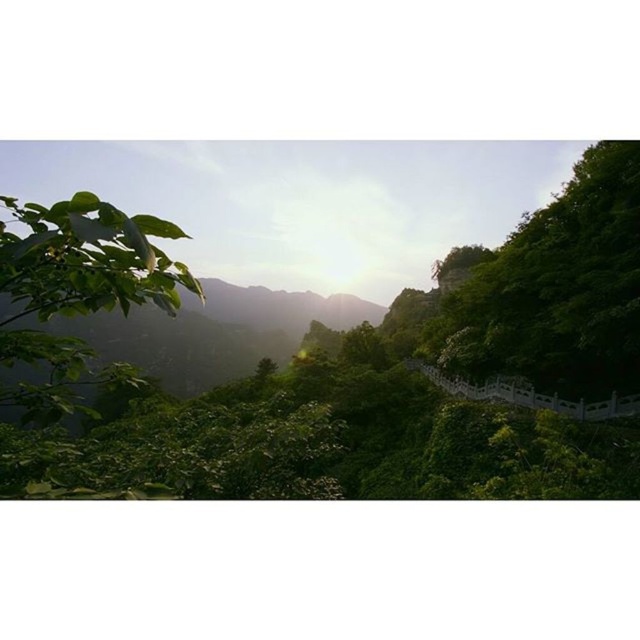
You are standing on a mountain trail and see both the green leafy tree at right and the green leafy tree at left. Which tree is positioned higher in the image?

The green leafy tree at right is positioned higher in the image than the green leafy tree at left.